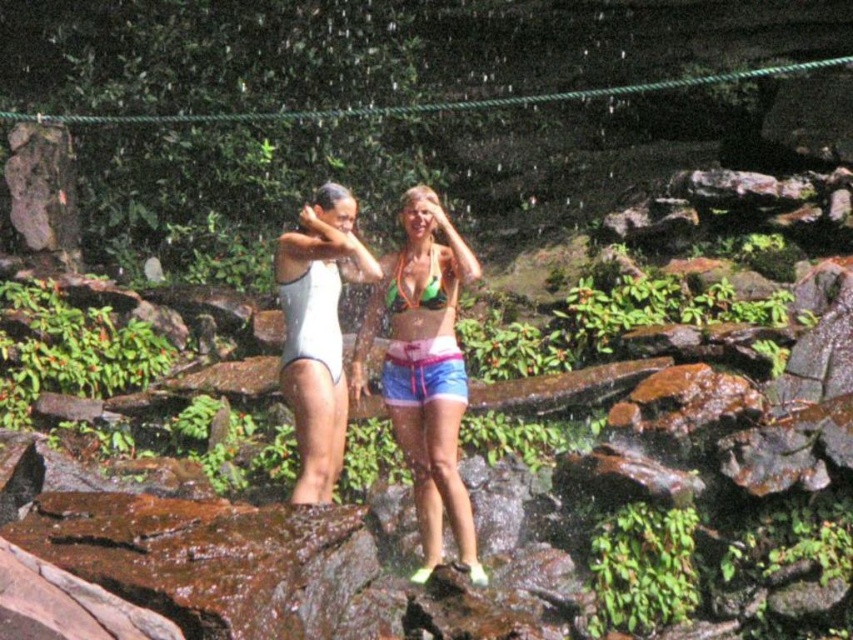
Question: Which point is closer to the camera taking this photo?

Choices:
 (A) (440, 392)
 (B) (410, 356)
 (C) (439, 304)
 (D) (334, 280)

Answer: (A)

Question: Can you confirm if neon green bikini top at center is wider than multicolored fabric shorts at center?

Choices:
 (A) yes
 (B) no

Answer: (A)

Question: Among these points, which one is nearest to the camera?

Choices:
 (A) (428, 362)
 (B) (431, 275)
 (C) (293, 358)

Answer: (C)

Question: Can you confirm if neon green bikini top at center is smaller than white matte swimsuit at center?

Choices:
 (A) no
 (B) yes

Answer: (A)

Question: Considering the real-world distances, which object is farthest from the white matte swimsuit at center?

Choices:
 (A) neon green bikini top at center
 (B) green matte bikini top at center

Answer: (A)

Question: Does multicolored fabric shorts at center appear under green matte bikini top at center?

Choices:
 (A) no
 (B) yes

Answer: (B)